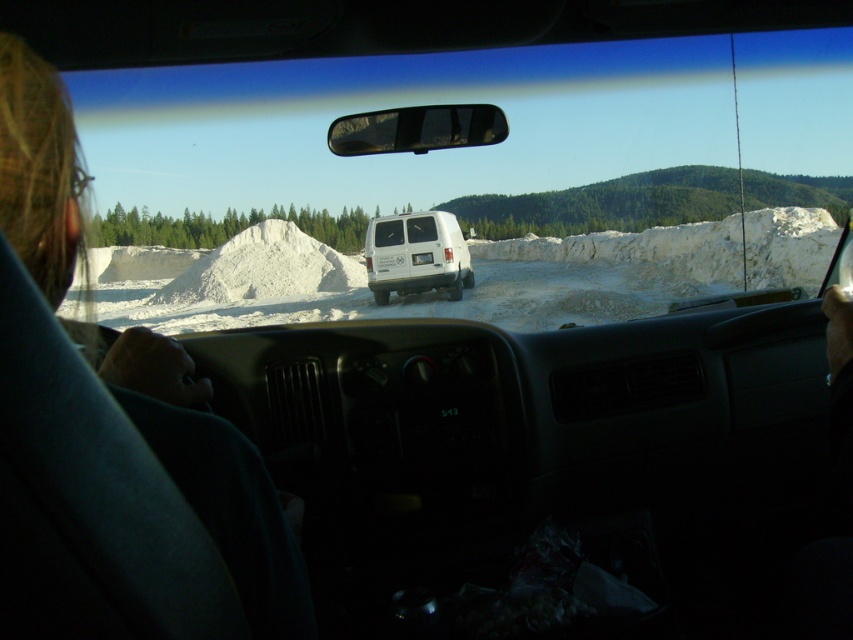
Is transparent glass car window at center shorter than blonde hair at left?

In fact, transparent glass car window at center may be taller than blonde hair at left.

Who is higher up, transparent glass car window at center or blonde hair at left?

transparent glass car window at center

Is point (732, 220) behind point (65, 99)?

Yes, point (732, 220) is farther from viewer.

Identify the location of transparent glass car window at center. The width and height of the screenshot is (853, 640). (482, 173).

The width and height of the screenshot is (853, 640). What do you see at coordinates (209, 472) in the screenshot?
I see `blonde hair at left` at bounding box center [209, 472].

Who is positioned more to the right, blonde hair at left or white matte van at center?

From the viewer's perspective, white matte van at center appears more on the right side.

What do you see at coordinates (209, 472) in the screenshot?
I see `blonde hair at left` at bounding box center [209, 472].

Locate an element on the screen. The height and width of the screenshot is (640, 853). blonde hair at left is located at coordinates (209, 472).

Between point (190, 266) and point (421, 291), which one is positioned in front?

Point (421, 291)

Does white powdery mound at center appear on the right side of white matte van at center?

No, white powdery mound at center is not to the right of white matte van at center.

Find the location of `white powdery mound at center`. white powdery mound at center is located at coordinates (263, 268).